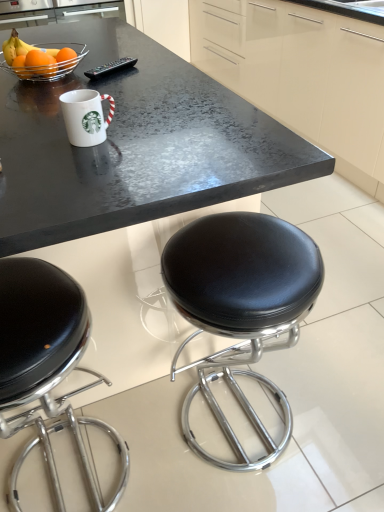
Identify the location of free location to the right of white glossy mug at upper center. point(173,131).